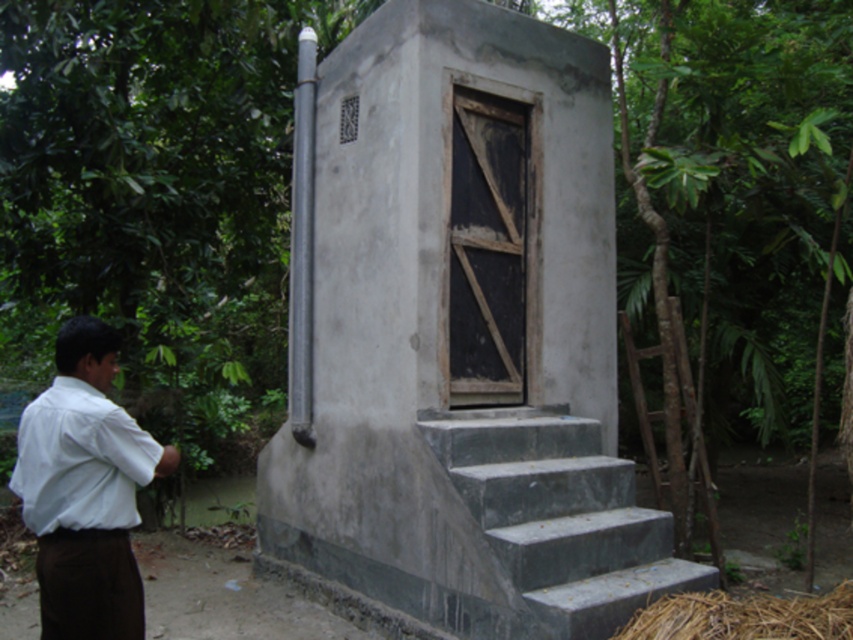
Question: Which object appears farthest from the camera in this image?

Choices:
 (A) white shirt at left
 (B) gray concrete stairs at center

Answer: (B)

Question: Does gray concrete hut at center appear over white matte dress shirt at left?

Choices:
 (A) yes
 (B) no

Answer: (A)

Question: Which point is closer to the camera?

Choices:
 (A) (450, 451)
 (B) (67, 483)
 (C) (70, 472)
 (D) (473, 435)

Answer: (C)

Question: Does white shirt at left have a greater width compared to white matte dress shirt at left?

Choices:
 (A) yes
 (B) no

Answer: (A)

Question: Does gray concrete hut at center appear on the left side of gray concrete stairs at center?

Choices:
 (A) no
 (B) yes

Answer: (B)

Question: Which of the following is the closest to the observer?

Choices:
 (A) (70, 628)
 (B) (360, 120)
 (C) (485, 477)
 (D) (126, 440)

Answer: (A)